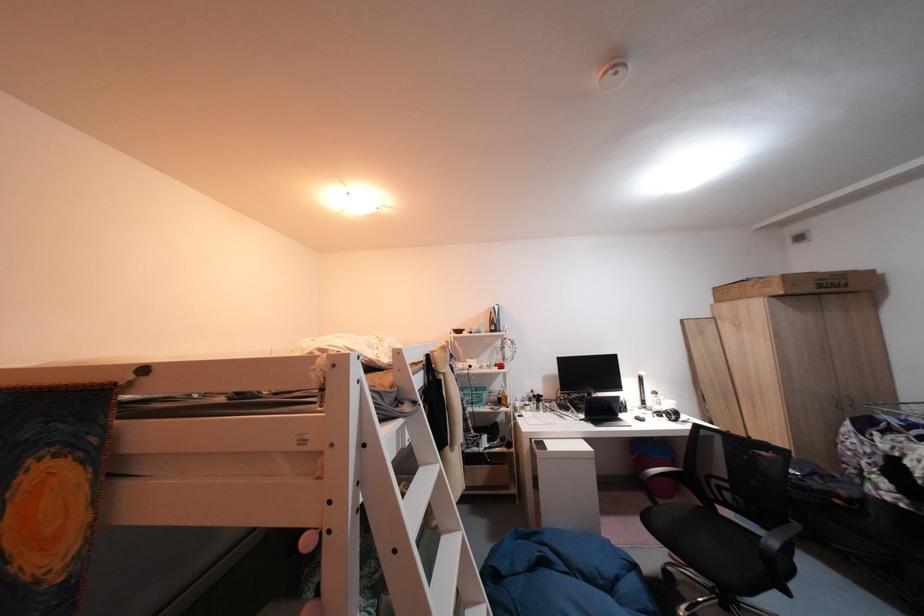
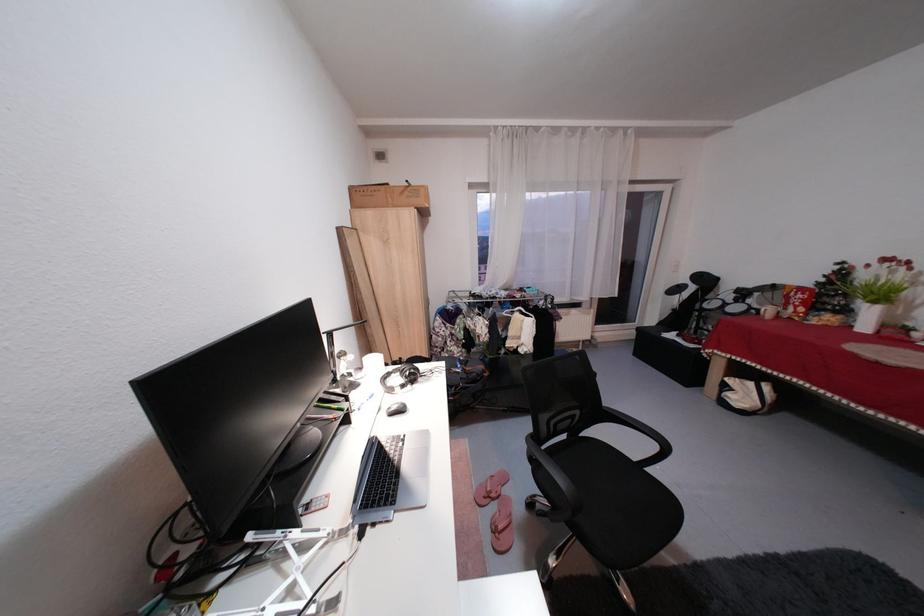
The point at (772, 280) is marked in the first image. Where is the corresponding point in the second image?

(420, 185)